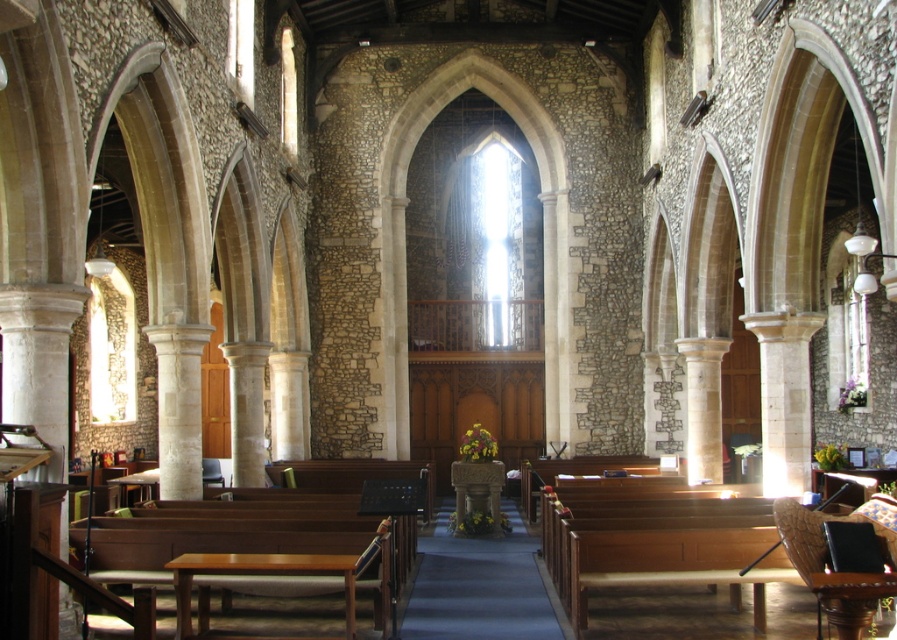
You are standing at the entrance of the church and notice two points marked on the floor. The first point is labeled as point (779,564) and the second as point (846,588). Based on their positions, which point is closer to the altar?

Point (779,564) is behind point (846,588), so the point closer to the altar is point (779,564).

You are a visitor in the church and want to sit down. You see the wooden polished bench at lower right and the leather cushioned chair at lower right. Which seating option provides more space for you to sit comfortably?

The wooden polished bench at lower right has a larger size compared to the leather cushioned chair at lower lower right, so it provides more space for sitting comfortably.

In the scene shown: You are a visitor entering the church and want to sit down. You see the wooden polished bench at lower right and the leather cushioned chair at lower right. Which one is closer to the entrance?

The wooden polished bench at lower right is closer to the entrance because the leather cushioned chair at lower right is behind it.